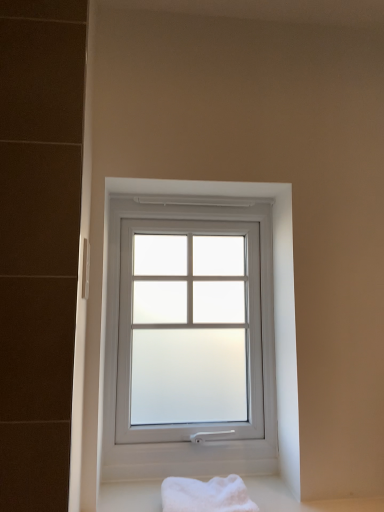
Question: From the image's perspective, would you say white soft bath towel at lower center is positioned over white frosted glass window at center?

Choices:
 (A) no
 (B) yes

Answer: (A)

Question: Is white frosted glass window at center inside white soft bath towel at lower center?

Choices:
 (A) no
 (B) yes

Answer: (A)

Question: Does white soft bath towel at lower center appear on the right side of white frosted glass window at center?

Choices:
 (A) no
 (B) yes

Answer: (B)

Question: Can you confirm if white soft bath towel at lower center is shorter than white frosted glass window at center?

Choices:
 (A) yes
 (B) no

Answer: (A)

Question: Considering the relative sizes of white soft bath towel at lower center and white frosted glass window at center in the image provided, is white soft bath towel at lower center thinner than white frosted glass window at center?

Choices:
 (A) yes
 (B) no

Answer: (B)

Question: Is white soft bath towel at lower center far away from white frosted glass window at center?

Choices:
 (A) yes
 (B) no

Answer: (B)

Question: Is white frosted glass window at center smaller than white soft bath towel at lower center?

Choices:
 (A) yes
 (B) no

Answer: (B)

Question: Is white frosted glass window at center surrounding white soft bath towel at lower center?

Choices:
 (A) yes
 (B) no

Answer: (B)

Question: Is white frosted glass window at center behind white soft bath towel at lower center?

Choices:
 (A) yes
 (B) no

Answer: (A)

Question: From a real-world perspective, is white frosted glass window at center positioned over white soft bath towel at lower center based on gravity?

Choices:
 (A) no
 (B) yes

Answer: (B)

Question: Does white frosted glass window at center come in front of white soft bath towel at lower center?

Choices:
 (A) yes
 (B) no

Answer: (B)

Question: Is white frosted glass window at center not inside white soft bath towel at lower center?

Choices:
 (A) yes
 (B) no

Answer: (A)

Question: Does point [266, 253] appear closer or farther from the camera than point [236, 503]?

Choices:
 (A) farther
 (B) closer

Answer: (A)